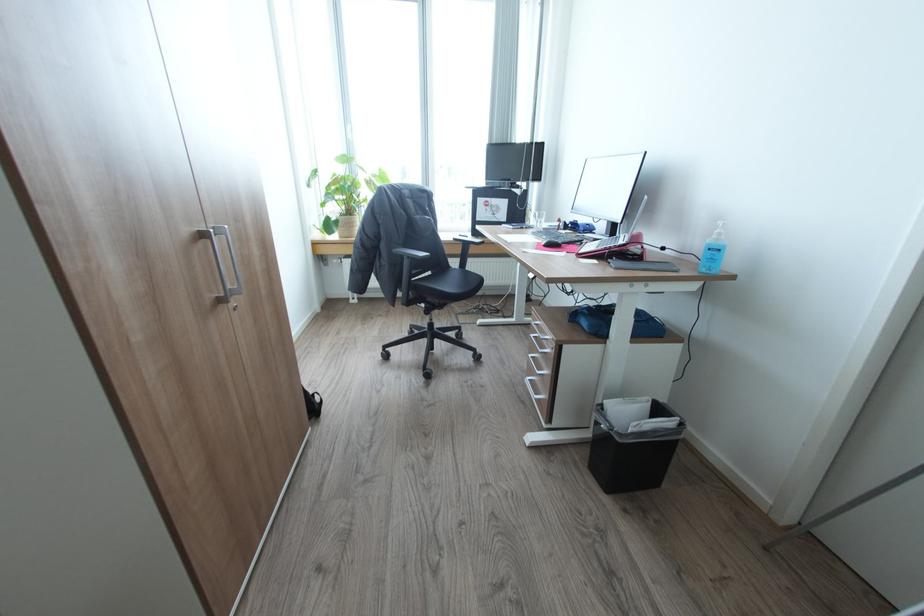
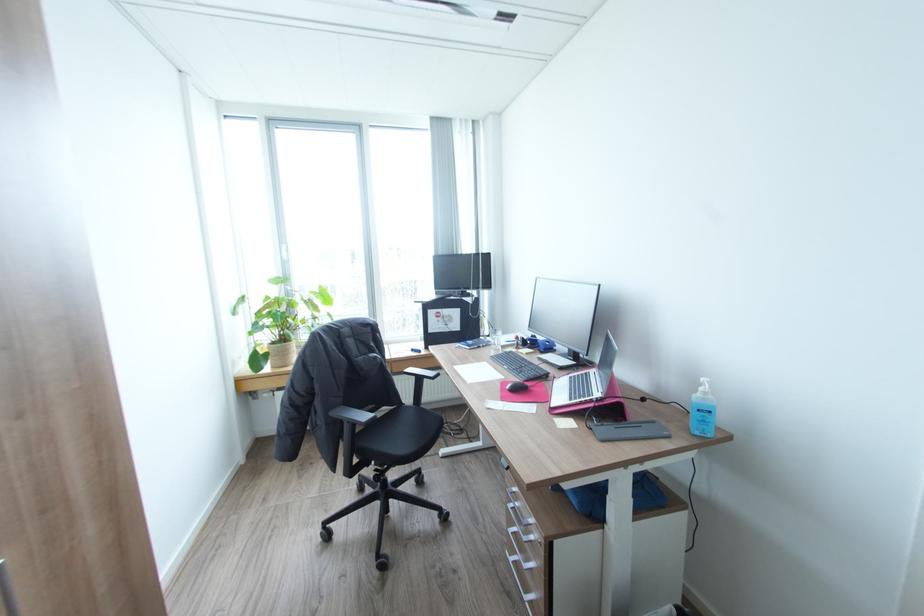
Question: I am providing you with two images of the same scene from different viewpoints. Which of the following objects are not visible in image2?

Choices:
 (A) silver drawer handle
 (B) red computer mouse
 (C) grey drawing tablet
 (D) none of these

Answer: (D)